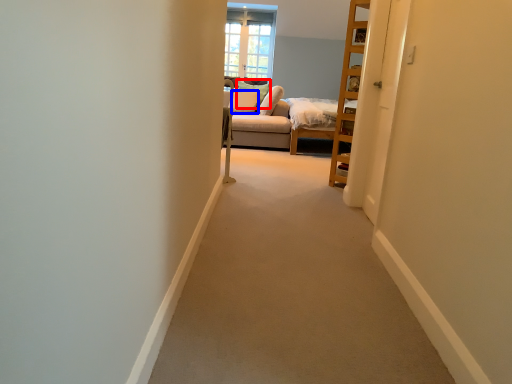
Question: Among these objects, which one is farthest to the camera, pillow (highlighted by a red box) or pillow (highlighted by a blue box)?

Choices:
 (A) pillow
 (B) pillow

Answer: (A)